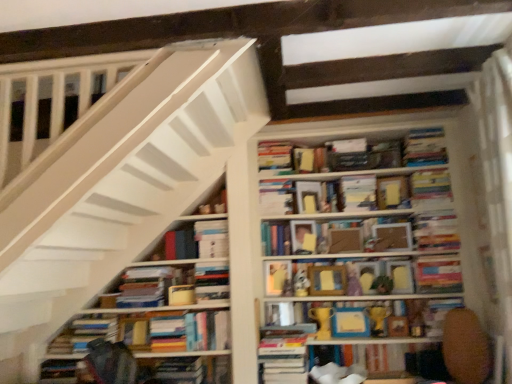
You are a GUI agent. You are given a task and a screenshot of the screen. Output one action in this format:
    pyautogui.click(x=<x>, y=<y>)
    Task: Click on the hardcover books at center, which ranks as the 9th book in right-to-left order
    
    Given the screenshot: What is the action you would take?
    pyautogui.click(x=274, y=155)

Find the location of a particular element. The height and width of the screenshot is (384, 512). matte blue book at center, the 4th book when ordered from left to right is located at coordinates (275, 239).

This screenshot has width=512, height=384. I want to click on hardcover books at lower left, arranged as the 1th book when viewed from the left, so click(x=84, y=333).

Measure the distance between hardcover book at center, which appears as the thirteenth paperback book when viewed from the right, and camera.

The distance of hardcover book at center, which appears as the thirteenth paperback book when viewed from the right, from camera is 7.77 feet.

What do you see at coordinates (308, 196) in the screenshot? This screenshot has height=384, width=512. I see `hardcover book at center, which is the 5th paperback book in left-to-right order` at bounding box center [308, 196].

The image size is (512, 384). I want to click on hardcover books at center, the twelfth book in the right-to-left sequence, so tap(193, 242).

The image size is (512, 384). Find the location of `white wooden bookcase at upper center`. white wooden bookcase at upper center is located at coordinates (264, 280).

Where is `hardcover books at center, the 5th book when ordered from left to right`? hardcover books at center, the 5th book when ordered from left to right is located at coordinates (274, 155).

Could you tell me if hardcover book at center, which appears as the fifth paperback book when viewed from the right, is turned towards hardcover book at center, which is the 5th paperback book in left-to-right order?

No, hardcover book at center, which appears as the fifth paperback book when viewed from the right, is not oriented towards hardcover book at center, which is the 5th paperback book in left-to-right order.

From the image's perspective, which one is positioned lower, hardcover book at center, which appears as the fifth paperback book when viewed from the right, or hardcover book at center, which is counted as the ninth paperback book, starting from the right?

hardcover book at center, which is counted as the ninth paperback book, starting from the right, appears lower in the image.

Are hardcover book at center, the 9th paperback book viewed from the left, and hardcover book at center, which is the 5th paperback book in left-to-right order, located far from each other?

hardcover book at center, the 9th paperback book viewed from the left, is actually quite close to hardcover book at center, which is the 5th paperback book in left-to-right order.

In terms of height, does hardcover book at center, the 9th paperback book viewed from the left, look taller or shorter compared to hardcover book at center, which is the 5th paperback book in left-to-right order?

In the image, hardcover book at center, the 9th paperback book viewed from the left, appears to be shorter than hardcover book at center, which is the 5th paperback book in left-to-right order.

Is hardcover book at center, which appears as the thirteenth paperback book when viewed from the right, far away from hardcover book at center, marked as the 3th book in a left-to-right arrangement?

No, there isn't a large distance between hardcover book at center, which appears as the thirteenth paperback book when viewed from the right, and hardcover book at center, marked as the 3th book in a left-to-right arrangement.

From the picture: Considering the sizes of objects hardcover book at center, marked as the 1th paperback book in a left-to-right arrangement, and hardcover book at center, marked as the 3th book in a left-to-right arrangement, in the image provided, who is bigger, hardcover book at center, marked as the 1th paperback book in a left-to-right arrangement, or hardcover book at center, marked as the 3th book in a left-to-right arrangement,?

With larger size is hardcover book at center, marked as the 3th book in a left-to-right arrangement.

In the scene shown: Which object is wider, hardcover book at center, marked as the 1th paperback book in a left-to-right arrangement, or hardcover book at center, the eleventh book from the right?

Wider between the two is hardcover book at center, the eleventh book from the right.

Is hardcover book at center, which is the sixth paperback book in left-to-right order, directly adjacent to yellow matte trophy at center, the eighth book viewed from the left?

hardcover book at center, which is the sixth paperback book in left-to-right order, and yellow matte trophy at center, the eighth book viewed from the left, are clearly separated.

Is hardcover book at center, which is the sixth paperback book in left-to-right order, closer to the viewer compared to yellow matte trophy at center, the eighth book viewed from the left?

No.

Which is in front, point (322, 273) or point (362, 323)?

The point (362, 323) is closer to the camera.

Looking at this image, which object is thinner, hardcover book at center, the 9th paperback book viewed from the left, or wooden frame at center, acting as the 9th book starting from the left?

Thinner between the two is hardcover book at center, the 9th paperback book viewed from the left.

This screenshot has width=512, height=384. Identify the location of the 3rd paperback book above the wooden frame at center, acting as the 9th book starting from the left (from a real-world perspective). (358, 193).

From the image's perspective, is hardcover book at center, the 9th paperback book viewed from the left, above wooden frame at center, arranged as the 5th book when viewed from the right?

Yes, from the image's perspective, hardcover book at center, the 9th paperback book viewed from the left, is over wooden frame at center, arranged as the 5th book when viewed from the right.

Is hardcover book at center, which appears as the fifth paperback book when viewed from the right, turned away from wooden frame at center, arranged as the 5th book when viewed from the right?

No, hardcover book at center, which appears as the fifth paperback book when viewed from the right, is not facing the opposite direction of wooden frame at center, arranged as the 5th book when viewed from the right.

Is wooden toy at center, the fourth toy from the left, completely or partially inside matte yellow paper at center, which is the second paperback book from left to right?

That's incorrect, wooden toy at center, the fourth toy from the left, is not inside matte yellow paper at center, which is the second paperback book from left to right.

From a real-world perspective, which is physically above, matte yellow paper at center, the 12th paperback book when ordered from right to left, or wooden toy at center, the fourth toy from the left?

matte yellow paper at center, the 12th paperback book when ordered from right to left, is physically above.

Is matte yellow paper at center, the 12th paperback book when ordered from right to left, bigger than wooden toy at center, which is the 1th toy in right-to-left order?

Yes.

From the image's perspective, is matte yellow paper at center, which is the second paperback book from left to right, positioned above or below wooden toy at center, the fourth toy from the left?

Based on their image positions, matte yellow paper at center, which is the second paperback book from left to right, is located above wooden toy at center, the fourth toy from the left.

Who is shorter, hardcover book at center, the 12th book in the left-to-right sequence, or hardcover books at center, arranged as the 8th book when viewed from the right?

With less height is hardcover book at center, the 12th book in the left-to-right sequence.

Which object is closer to the camera, hardcover book at center, the 12th book in the left-to-right sequence, or hardcover books at center, arranged as the 8th book when viewed from the right?

hardcover books at center, arranged as the 8th book when viewed from the right, is more forward.

Who is smaller, hardcover book at center, arranged as the 2th book when viewed from the right, or hardcover books at center, arranged as the 8th book when viewed from the right?

Smaller between the two is hardcover book at center, arranged as the 2th book when viewed from the right.

From the image's perspective, is hardcover book at center, the 12th book in the left-to-right sequence, under hardcover books at center, the 6th book viewed from the left?

No, from the image's perspective, hardcover book at center, the 12th book in the left-to-right sequence, is not below hardcover books at center, the 6th book viewed from the left.

Is plush white bear at center, which ranks as the first toy in left-to-right order, inside or outside of hardcover book at center, which ranks as the eighth paperback book in right-to-left order?

plush white bear at center, which ranks as the first toy in left-to-right order, exists outside the volume of hardcover book at center, which ranks as the eighth paperback book in right-to-left order.

From the picture: In the image, is plush white bear at center, which ranks as the first toy in left-to-right order, on the left side or the right side of hardcover book at center, which ranks as the eighth paperback book in right-to-left order?

In the image, plush white bear at center, which ranks as the first toy in left-to-right order, appears on the left side of hardcover book at center, which ranks as the eighth paperback book in right-to-left order.

Is plush white bear at center, which ranks as the first toy in left-to-right order, facing towards hardcover book at center, which ranks as the eighth paperback book in right-to-left order?

No, plush white bear at center, which ranks as the first toy in left-to-right order, is not facing towards hardcover book at center, which ranks as the eighth paperback book in right-to-left order.

From the image's perspective, between plush white bear at center, which ranks as the first toy in left-to-right order, and hardcover book at center, which ranks as the eighth paperback book in right-to-left order, who is located below?

From the image's view, plush white bear at center, which ranks as the first toy in left-to-right order, is below.

Find the location of `the 1st paperback book positioned above the hardcover book at center, which appears as the fifth paperback book when viewed from the right (from a real-world perspective)`. the 1st paperback book positioned above the hardcover book at center, which appears as the fifth paperback book when viewed from the right (from a real-world perspective) is located at coordinates (308, 196).

Locate an element on the screen. paperback book that is the 4th one below the hardcover book at center, the eleventh book from the right (from a real-world perspective) is located at coordinates (181, 295).

Looking at the image, which one is located further to hardcover books at lower left, acting as the thirteenth book starting from the right, hardcover book at center, the 12th paperback book in the left-to-right sequence, or matte cardboard photo frame at center, the tenth paperback book when ordered from left to right?

hardcover book at center, the 12th paperback book in the left-to-right sequence, lies further to hardcover books at lower left, acting as the thirteenth book starting from the right, than the other object.

When comparing their distances from hardcover book at center, which ranks as the eighth paperback book in right-to-left order, does hardcover book at center, marked as the 2th paperback book in a right-to-left arrangement, or wooden picture frame at center, arranged as the 7th book when viewed from the left, seem closer?

The object closer to hardcover book at center, which ranks as the eighth paperback book in right-to-left order, is wooden picture frame at center, arranged as the 7th book when viewed from the left.

When comparing their distances from hardcover book at center, which appears as the fifth paperback book when viewed from the right, does hardcover books at center, arranged as the 8th book when viewed from the right, or white wooden bookcase at upper center seem closer?

white wooden bookcase at upper center lies closer to hardcover book at center, which appears as the fifth paperback book when viewed from the right, than the other object.

Estimate the real-world distances between objects in this image. Which object is further from matte yellow paperback book at center, which is the 6th paperback book from right to left, hardcover book at center, the thirteenth book positioned from the left, or shiny gold trophy at center, placed as the 2th toy when sorted from left to right?

hardcover book at center, the thirteenth book positioned from the left.

Looking at the image, which one is located further to hardcover book at upper center, marked as the 11th book in a left-to-right arrangement, hardcover book at center, which is counted as the ninth paperback book, starting from the right, or hardcover book at center, the eleventh book from the right?

Based on the image, hardcover book at center, the eleventh book from the right, appears to be further to hardcover book at upper center, marked as the 11th book in a left-to-right arrangement.

Which object lies further to the anchor point wooden picture frame at center, arranged as the 7th book when viewed from the left, matte yellow paperback book at center, the fourth paperback book viewed from the left, or hardcover book at center, which appears as the thirteenth paperback book when viewed from the right?

hardcover book at center, which appears as the thirteenth paperback book when viewed from the right, lies further to wooden picture frame at center, arranged as the 7th book when viewed from the left, than the other object.

In the scene shown: Estimate the real-world distances between objects in this image. Which object is closer to hardcover book at upper right, acting as the first paperback book starting from the right, hardcover book at center, which ranks as the eighth paperback book in right-to-left order, or hardcover book at center, marked as the 2th paperback book in a right-to-left arrangement?

hardcover book at center, marked as the 2th paperback book in a right-to-left arrangement, is closer to hardcover book at upper right, acting as the first paperback book starting from the right.

Consider the image. Based on their spatial positions, is hardcover books at center, arranged as the 8th book when viewed from the right, or hardcover book at upper right, the thirteenth paperback book from the left, further from yellow matte trophy at center, the eighth book viewed from the left?

The object further to yellow matte trophy at center, the eighth book viewed from the left, is hardcover book at upper right, the thirteenth paperback book from the left.

I want to click on paperback book between gold metallic trophy at center-right, which is counted as the second toy, starting from the right, and hardcover book at lower right, arranged as the 10th book when viewed from the left, from top to bottom, so click(x=350, y=322).

Identify the location of bookcase between hardcover book at center, which appears as the thirteenth paperback book when viewed from the right, and plush white bear at center, which ranks as the first toy in left-to-right order, from left to right. (264, 280).

The height and width of the screenshot is (384, 512). I want to click on toy between plush white bear at center, which ranks as the first toy in left-to-right order, and yellow matte trophy at center, the eighth book viewed from the left, from left to right, so click(322, 321).

Locate an element on the screen. This screenshot has width=512, height=384. bookcase between hardcover books at center, positioned as the second book in left-to-right order, and brown leather swivel chair at lower right, in the horizontal direction is located at coordinates (264, 280).